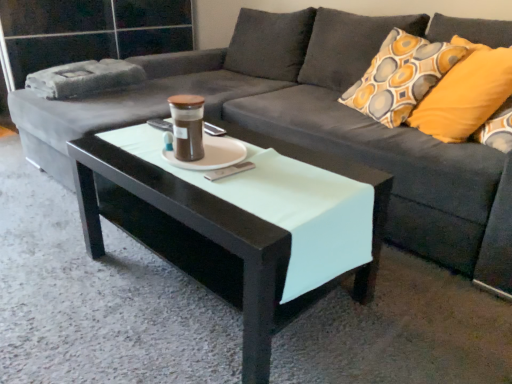
Question: Considering the positions of point (163, 24) and point (437, 92), is point (163, 24) closer or farther from the camera than point (437, 92)?

Choices:
 (A) closer
 (B) farther

Answer: (B)

Question: From the image's perspective, is transparent glass door at upper left positioned above or below yellow fabric pillow at right?

Choices:
 (A) above
 (B) below

Answer: (A)

Question: Considering the real-world distances, which object is farthest from the brown glass jar at center?

Choices:
 (A) yellow fabric pillow at right
 (B) transparent glass door at upper left
 (C) black glossy coffee table at center
 (D) white matte saucer at center

Answer: (B)

Question: Estimate the real-world distances between objects in this image. Which object is farther from the transparent glass door at upper left?

Choices:
 (A) brown glass jar at center
 (B) yellow fabric pillow at right
 (C) black glossy coffee table at center
 (D) white matte saucer at center

Answer: (B)